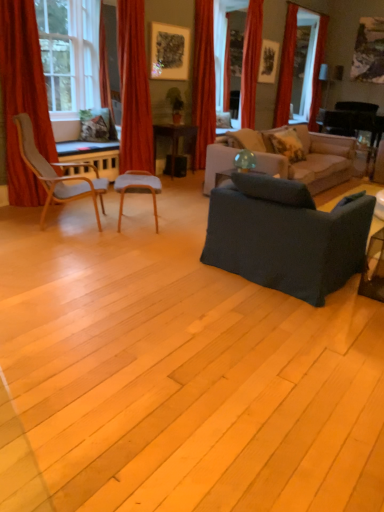
Question: Is red velvet curtain at upper right, which is the sixth curtain from front to back, turned away from suede beige couch at center, arranged as the second studio couch when viewed from the front?

Choices:
 (A) yes
 (B) no

Answer: (B)

Question: Does red velvet curtain at upper right, the first curtain from the right, contain suede beige couch at center, arranged as the second studio couch when viewed from the front?

Choices:
 (A) no
 (B) yes

Answer: (A)

Question: Can you see red velvet curtain at upper right, the 1th curtain when ordered from back to front, touching suede beige couch at center, arranged as the second studio couch when viewed from the front?

Choices:
 (A) yes
 (B) no

Answer: (B)

Question: Considering the relative positions of red velvet curtain at upper right, the first curtain from the right, and suede beige couch at center, the 1th studio couch viewed from the back, in the image provided, is red velvet curtain at upper right, the first curtain from the right, to the right of suede beige couch at center, the 1th studio couch viewed from the back, from the viewer's perspective?

Choices:
 (A) yes
 (B) no

Answer: (A)

Question: Can you confirm if red velvet curtain at upper right, the first curtain from the right, is wider than suede beige couch at center, the 1th studio couch viewed from the back?

Choices:
 (A) no
 (B) yes

Answer: (A)

Question: From the image's perspective, is red velvet curtain at upper right, which is the sixth curtain from front to back, beneath suede beige couch at center, the 1th studio couch viewed from the back?

Choices:
 (A) yes
 (B) no

Answer: (B)

Question: Could red velvet curtain at upper center, positioned as the fourth curtain in front-to-back order, be considered to be inside red velvet curtain at upper center, which appears as the fourth curtain when viewed from the right?

Choices:
 (A) yes
 (B) no

Answer: (B)

Question: Is red velvet curtain at upper center, arranged as the fourth curtain when viewed from the back, far away from red velvet curtain at upper center, which is counted as the 3th curtain, starting from the back?

Choices:
 (A) no
 (B) yes

Answer: (A)

Question: From the image's perspective, would you say red velvet curtain at upper center, which appears as the third curtain when viewed from the front, is positioned over red velvet curtain at upper center, the fourth curtain in the left-to-right sequence?

Choices:
 (A) no
 (B) yes

Answer: (A)

Question: Is red velvet curtain at upper center, the 3th curtain viewed from the left, taller than red velvet curtain at upper center, the fourth curtain in the left-to-right sequence?

Choices:
 (A) yes
 (B) no

Answer: (A)

Question: Is red velvet curtain at upper center, the 3th curtain viewed from the left, bigger than red velvet curtain at upper center, which is counted as the 3th curtain, starting from the back?

Choices:
 (A) yes
 (B) no

Answer: (A)

Question: Is red velvet curtain at upper center, which appears as the third curtain when viewed from the front, facing away from red velvet curtain at upper center, the fourth curtain in the left-to-right sequence?

Choices:
 (A) yes
 (B) no

Answer: (B)

Question: Can you confirm if red velvet curtain at upper right, positioned as the second curtain in right-to-left order, is thinner than red velvet curtain at upper center, which appears as the 3th curtain when viewed from the right?

Choices:
 (A) yes
 (B) no

Answer: (A)